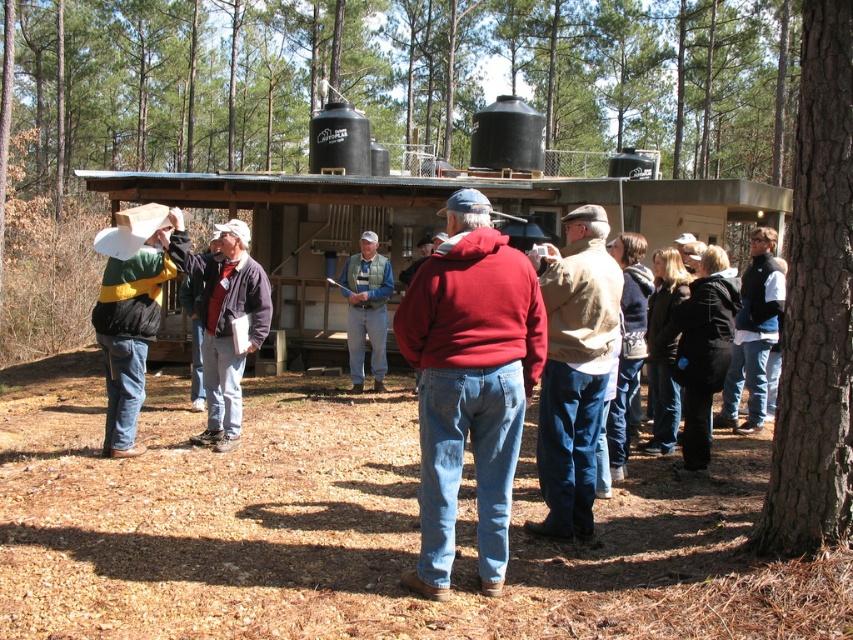
Question: Is brown bark tree at center to the left of red matte hoodie at center from the viewer's perspective?

Choices:
 (A) yes
 (B) no

Answer: (A)

Question: Can you confirm if brown bark tree at center is positioned to the right of smooth brown bark at right?

Choices:
 (A) yes
 (B) no

Answer: (B)

Question: Which object appears farthest from the camera in this image?

Choices:
 (A) black fleece jacket at right
 (B) blue denim jeans at center

Answer: (B)

Question: Is the position of beige sweater at center less distant than that of green and yellow striped shirt at left?

Choices:
 (A) yes
 (B) no

Answer: (A)

Question: Which of these objects is positioned farthest from the green and yellow striped shirt at left?

Choices:
 (A) brown bark tree at center
 (B) smooth brown bark at right
 (C) blue denim jeans at center

Answer: (A)

Question: Which object appears closest to the camera in this image?

Choices:
 (A) black fleece jacket at right
 (B) red matte hoodie at center
 (C) blue denim jeans at center
 (D) smooth brown bark at right

Answer: (D)